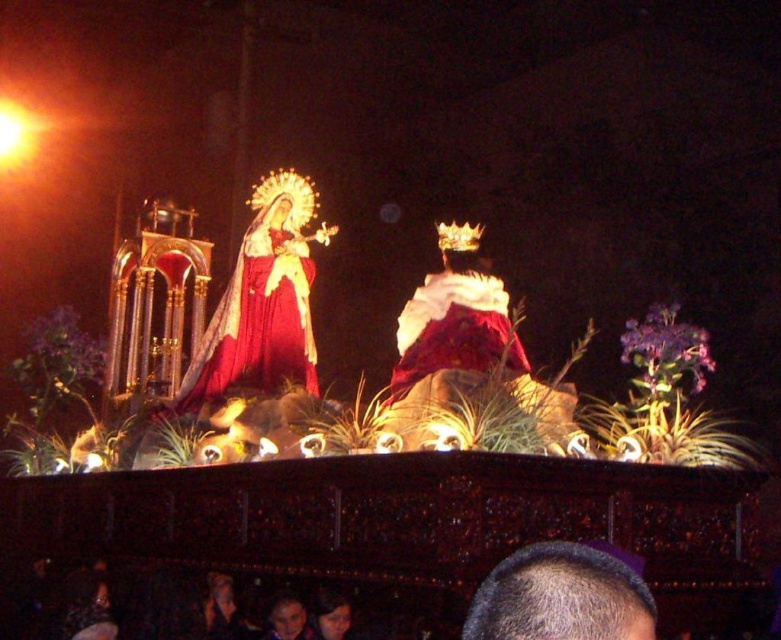
You are an event planner setting up a stage for a cultural performance. You need to place a spotlight on the matte gold statue at upper left and the white velvet robe at center. According to the scene description, which object should the spotlight be placed to the left of?

The matte gold statue at upper left is positioned on the left side of the white velvet robe at center, so the spotlight should be placed to the left of the white velvet robe at center.

You are an artist sketching the scene described. You need to ensure the proportions are accurate. Which object should you draw first, the gray hair at upper center or the white velvet robe at center, and why?

You should draw the white velvet robe at center first because the gray hair at upper center has a smaller size compared to it. Starting with the larger object ensures proper placement and proportion for the smaller detail.

You are an artist sketching the scene and want to ensure the placement of the gray hair at upper center and the white velvet robe at center is accurate. Which object is located to the right of the other?

The gray hair at upper center is positioned on the right side of white velvet robe at center.